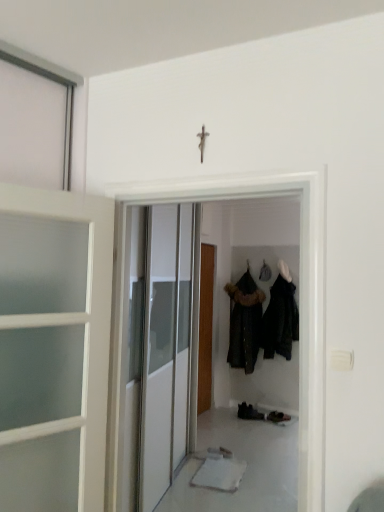
Question: Which direction should I rotate to look at dark fur-trimmed coat at center, acting as the first clothing starting from the left?

Choices:
 (A) left
 (B) right

Answer: (B)

Question: Is wooden door at center, the 1th door viewed from the back, shorter than dark matte coat at center, the second clothing viewed from the left?

Choices:
 (A) no
 (B) yes

Answer: (A)

Question: Is wooden door at center, the 1th door viewed from the back, facing towards dark matte coat at center, the second clothing viewed from the left?

Choices:
 (A) yes
 (B) no

Answer: (A)

Question: Does wooden door at center, positioned as the second door in front-to-back order, lie behind dark matte coat at center, the second clothing viewed from the left?

Choices:
 (A) yes
 (B) no

Answer: (A)

Question: Can you confirm if wooden door at center, the 1th door viewed from the back, is positioned to the right of dark matte coat at center, which appears as the first clothing when viewed from the right?

Choices:
 (A) yes
 (B) no

Answer: (B)

Question: Is wooden door at center, positioned as the second door in front-to-back order, positioned before dark matte coat at center, the second clothing viewed from the left?

Choices:
 (A) yes
 (B) no

Answer: (B)

Question: Considering the relative sizes of wooden door at center, positioned as the second door in front-to-back order, and dark matte coat at center, the second clothing viewed from the left, in the image provided, is wooden door at center, positioned as the second door in front-to-back order, thinner than dark matte coat at center, the second clothing viewed from the left,?

Choices:
 (A) no
 (B) yes

Answer: (B)

Question: Is white glossy door at center, the second door positioned from the back, far from dark fur-trimmed coat at center, marked as the 2th clothing in a right-to-left arrangement?

Choices:
 (A) yes
 (B) no

Answer: (A)

Question: Considering the relative sizes of white glossy door at center, placed as the first door when sorted from front to back, and dark fur-trimmed coat at center, marked as the 2th clothing in a right-to-left arrangement, in the image provided, is white glossy door at center, placed as the first door when sorted from front to back, shorter than dark fur-trimmed coat at center, marked as the 2th clothing in a right-to-left arrangement,?

Choices:
 (A) no
 (B) yes

Answer: (A)

Question: Is white glossy door at center, the second door positioned from the back, located outside dark fur-trimmed coat at center, acting as the first clothing starting from the left?

Choices:
 (A) yes
 (B) no

Answer: (A)

Question: From a real-world perspective, is white glossy door at center, placed as the first door when sorted from front to back, physically above dark fur-trimmed coat at center, acting as the first clothing starting from the left?

Choices:
 (A) no
 (B) yes

Answer: (B)

Question: Considering the relative sizes of white glossy door at center, placed as the first door when sorted from front to back, and dark fur-trimmed coat at center, acting as the first clothing starting from the left, in the image provided, is white glossy door at center, placed as the first door when sorted from front to back, smaller than dark fur-trimmed coat at center, acting as the first clothing starting from the left,?

Choices:
 (A) yes
 (B) no

Answer: (A)

Question: Is white glossy door at center, placed as the first door when sorted from front to back, facing away from dark fur-trimmed coat at center, marked as the 2th clothing in a right-to-left arrangement?

Choices:
 (A) no
 (B) yes

Answer: (A)

Question: Can you confirm if dark fur-trimmed coat at center, acting as the first clothing starting from the left, is taller than white glossy door at center, the second door positioned from the back?

Choices:
 (A) no
 (B) yes

Answer: (A)